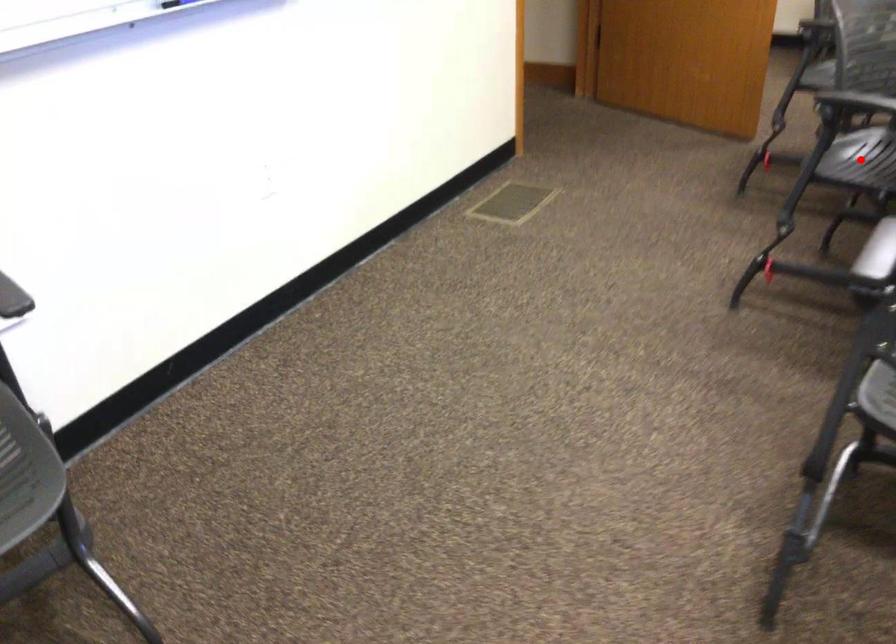
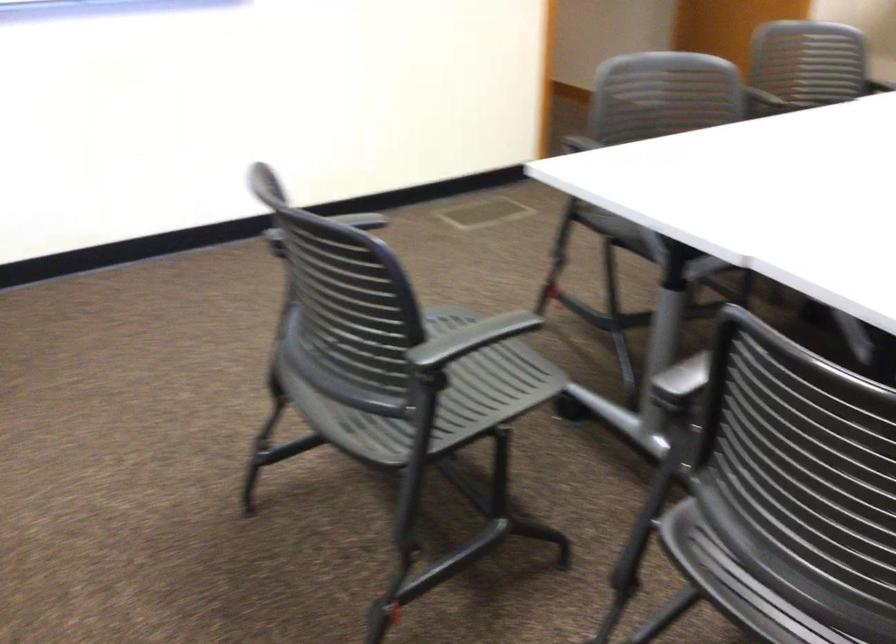
Question: I am providing you with two images of the same scene from different viewpoints. A red point is marked on the first image. At the location where the point appears in image 1, is it still visible in image 2?

Choices:
 (A) Yes
 (B) No

Answer: (B)